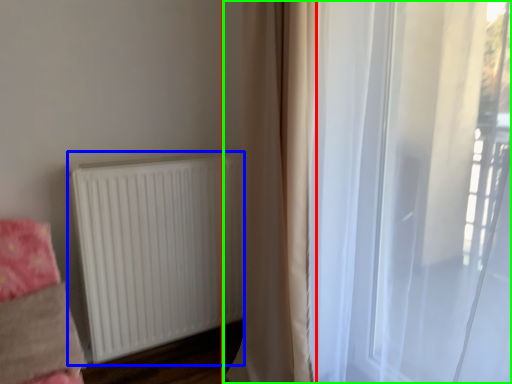
Question: Which object is positioned farthest from curtain (highlighted by a red box)? Select from radiator (highlighted by a blue box) and curtain (highlighted by a green box).

Choices:
 (A) radiator
 (B) curtain

Answer: (A)